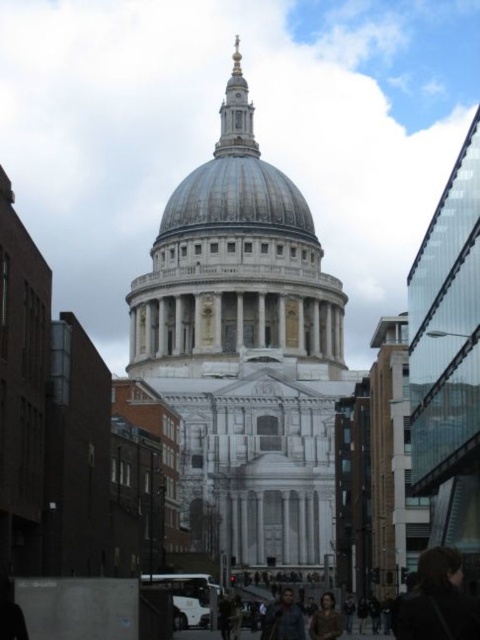
You are a tourist visiting St. Paul Cathedral and you see the white marble cathedral at center and the brown leather jacket at lower center. Which object is higher in the image?

The white marble cathedral at center is positioned over the brown leather jacket at lower center, so it is higher in the image.

You are standing in the city and see the point at coordinates (245, 353). Based on the scene description, what landmark does this point indicate?

The point at coordinates (245, 353) corresponds to the white marble cathedral at center, which is St. Pauls Cathedral in London, England.

You are an architect visiting St. Paul Cathedral. You notice the shiny silver dome at center and the brown leather jacket at lower center. Which object appears larger in the image?

The shiny silver dome at center appears larger than the brown leather jacket at lower center in the image.